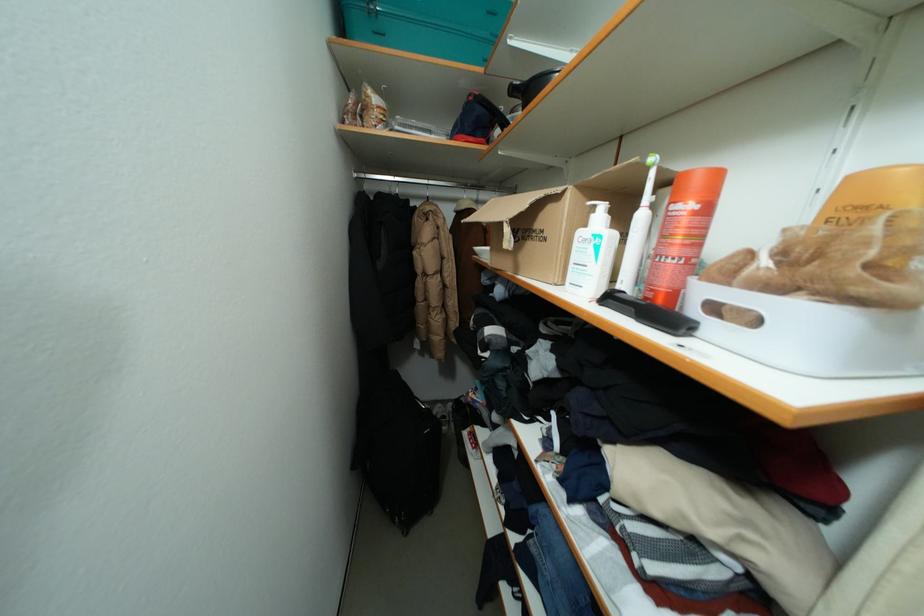
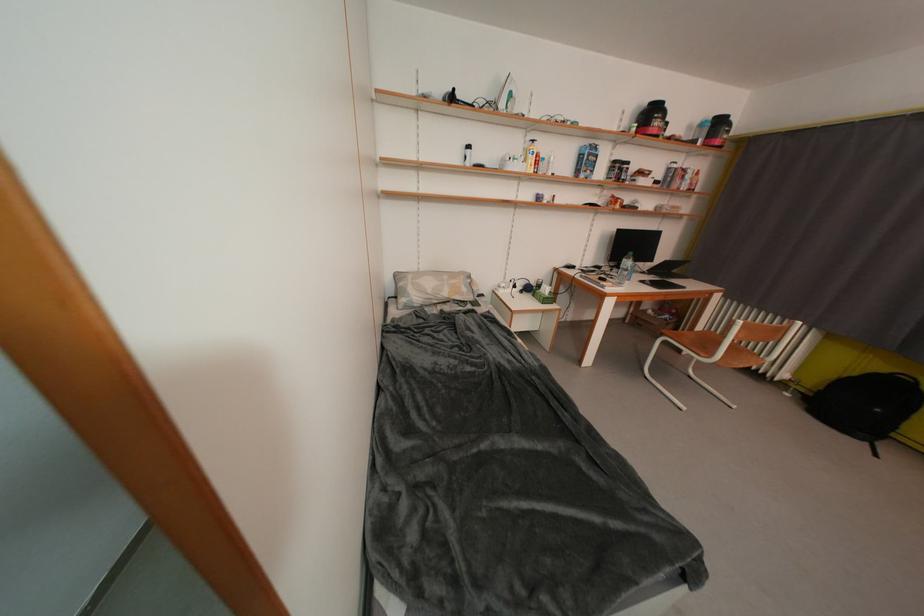
Question: In a continuous first-person perspective shot, in which direction is the camera moving?

Choices:
 (A) Left
 (B) Right
 (C) Forward
 (D) Backward

Answer: (B)